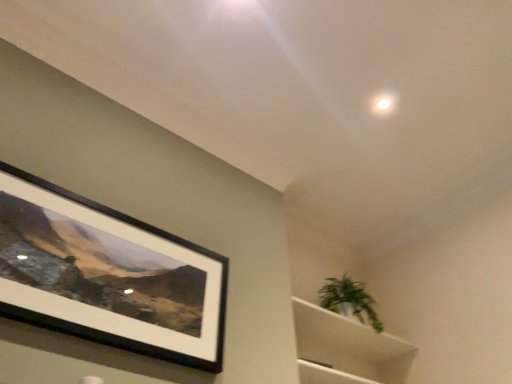
Question: Is green leafy plant at upper right far from white matte cabinet at lower right?

Choices:
 (A) no
 (B) yes

Answer: (A)

Question: From a real-world perspective, is green leafy plant at upper right on white matte cabinet at lower right?

Choices:
 (A) yes
 (B) no

Answer: (A)

Question: From the image's perspective, is green leafy plant at upper right beneath white matte cabinet at lower right?

Choices:
 (A) no
 (B) yes

Answer: (A)

Question: Can you confirm if green leafy plant at upper right is bigger than white matte cabinet at lower right?

Choices:
 (A) yes
 (B) no

Answer: (B)

Question: Can you confirm if green leafy plant at upper right is smaller than white matte cabinet at lower right?

Choices:
 (A) yes
 (B) no

Answer: (A)

Question: Is white matte cabinet at lower right spatially inside black matte picture frame at upper left, or outside of it?

Choices:
 (A) outside
 (B) inside

Answer: (A)

Question: From the image's perspective, is white matte cabinet at lower right located above or below black matte picture frame at upper left?

Choices:
 (A) below
 (B) above

Answer: (A)

Question: From a real-world perspective, is white matte cabinet at lower right physically located above or below black matte picture frame at upper left?

Choices:
 (A) below
 (B) above

Answer: (A)

Question: Relative to black matte picture frame at upper left, is white matte cabinet at lower right in front or behind?

Choices:
 (A) behind
 (B) front

Answer: (A)

Question: Considering the positions of point (3, 292) and point (345, 294), is point (3, 292) closer or farther from the camera than point (345, 294)?

Choices:
 (A) farther
 (B) closer

Answer: (B)

Question: Considering the positions of black matte picture frame at upper left and green leafy plant at upper right in the image, is black matte picture frame at upper left taller or shorter than green leafy plant at upper right?

Choices:
 (A) short
 (B) tall

Answer: (B)

Question: Visually, is black matte picture frame at upper left positioned to the left or to the right of green leafy plant at upper right?

Choices:
 (A) left
 (B) right

Answer: (A)

Question: Which is correct: black matte picture frame at upper left is inside green leafy plant at upper right, or outside of it?

Choices:
 (A) inside
 (B) outside

Answer: (B)

Question: From the image's perspective, is green leafy plant at upper right positioned above or below black matte picture frame at upper left?

Choices:
 (A) above
 (B) below

Answer: (B)

Question: In terms of height, does green leafy plant at upper right look taller or shorter compared to black matte picture frame at upper left?

Choices:
 (A) short
 (B) tall

Answer: (A)